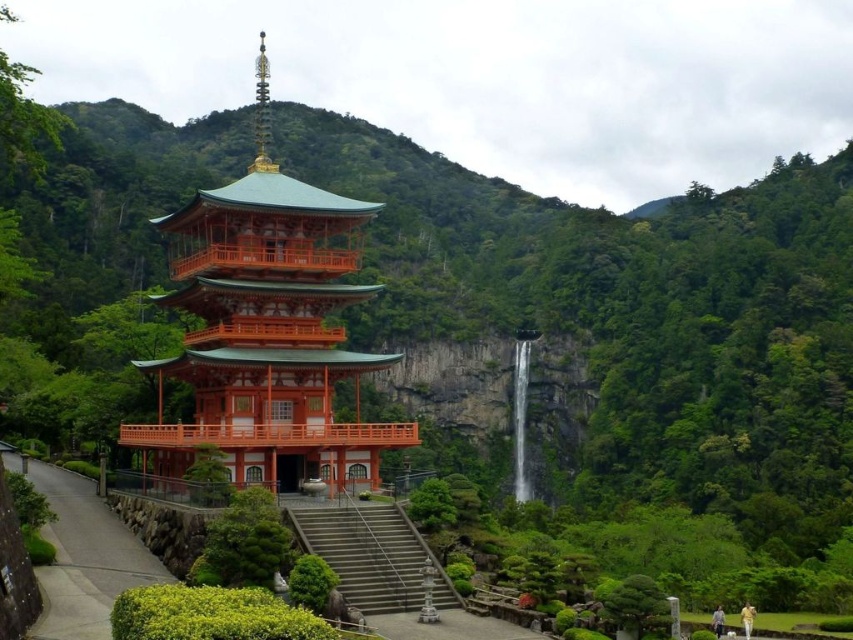
Question: Which point appears closest to the camera in this image?

Choices:
 (A) (80, 548)
 (B) (274, 253)

Answer: (A)

Question: Which of the following is the farthest from the observer?

Choices:
 (A) (83, 502)
 (B) (370, 509)
 (C) (334, 337)

Answer: (A)

Question: Which object is farther from the camera taking this photo?

Choices:
 (A) gray concrete stairs at center
 (B) smooth concrete path at lower left
 (C) orange lacquered wood pagoda at center
 (D) white smooth waterfall at center

Answer: (D)

Question: Does smooth concrete path at lower left have a lesser width compared to gray concrete stairs at center?

Choices:
 (A) no
 (B) yes

Answer: (A)

Question: In this image, where is orange lacquered wood pagoda at center located relative to smooth concrete path at lower left?

Choices:
 (A) above
 (B) below

Answer: (A)

Question: Can you confirm if gray concrete stairs at center is positioned to the right of white smooth waterfall at center?

Choices:
 (A) no
 (B) yes

Answer: (A)